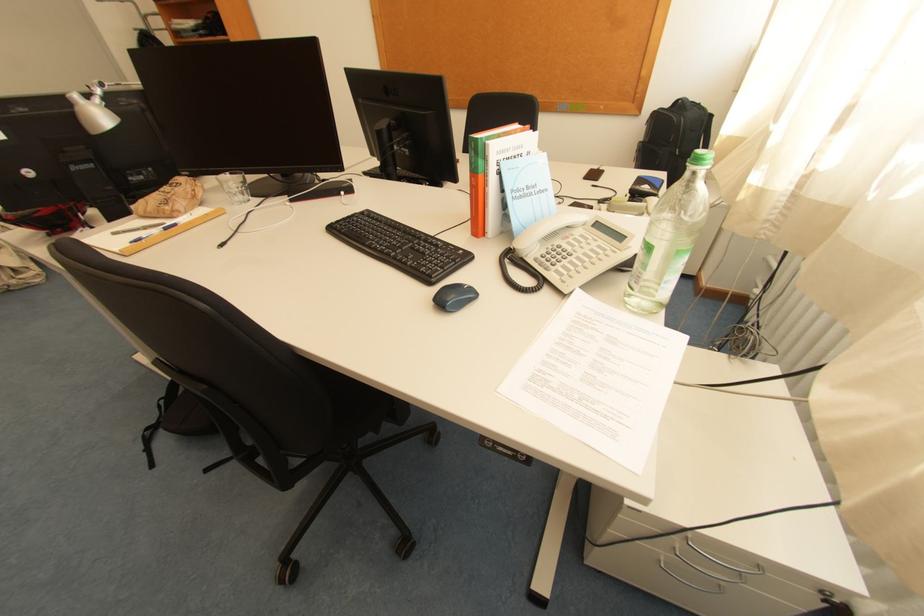
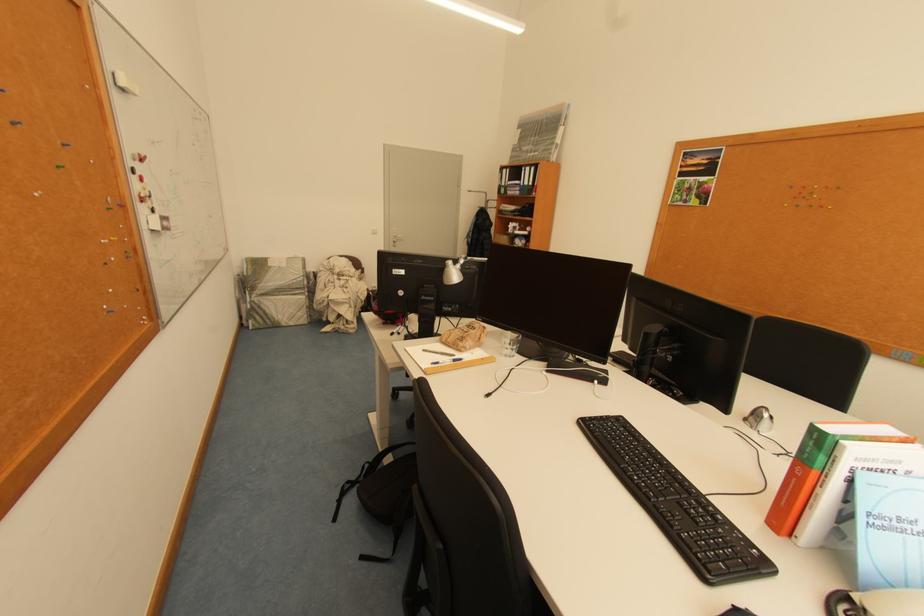
Locate, in the second image, the point that corresponds to (149,240) in the first image.

(445, 363)